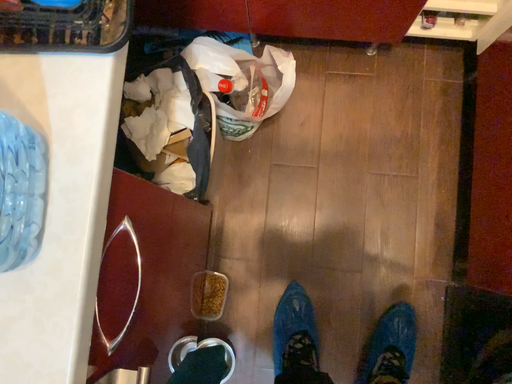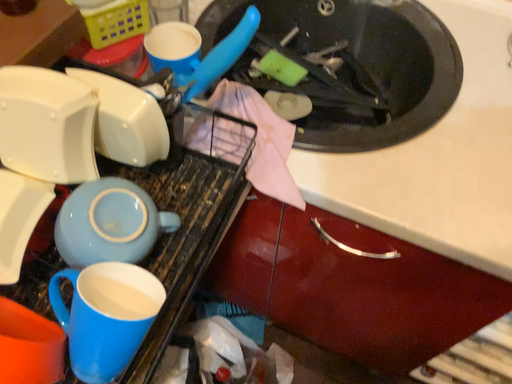
Question: Which way did the camera rotate in the video?

Choices:
 (A) rotated downward
 (B) rotated upward

Answer: (B)